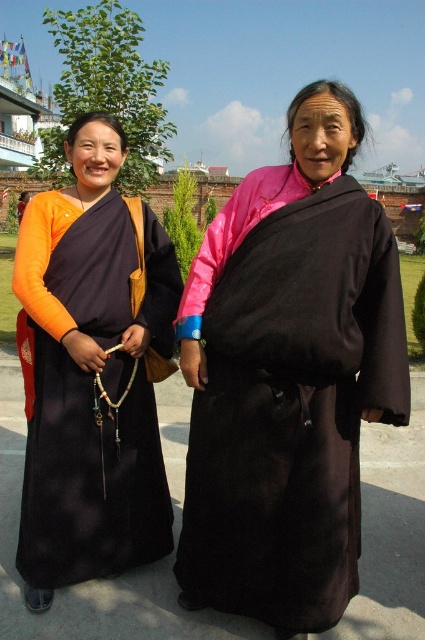
You are a photographer setting up a camera to capture the two individuals in the scene. You need to ensure that both the black silk dress at center and the matte black robe at left are fully visible in the frame. Based on their widths, which object should you prioritize positioning closer to the camera to avoid cropping?

The black silk dress at center might be wider than matte black robe at left, so you should prioritize positioning the black silk dress at center closer to the camera to ensure it fits within the frame.

You are a photographer setting up a shoot with two models wearing the black silk dress at center and matte black robe at left. The camera is positioned to capture both subjects in the frame. If the minimum required distance between the models for proper framing is 1 meter, will they need to adjust their positions?

The distance between the black silk dress at center and matte black robe at left is 91.11 centimeters, which is less than 1 meter. Therefore, the models need to move further apart to meet the required distance for proper framing.